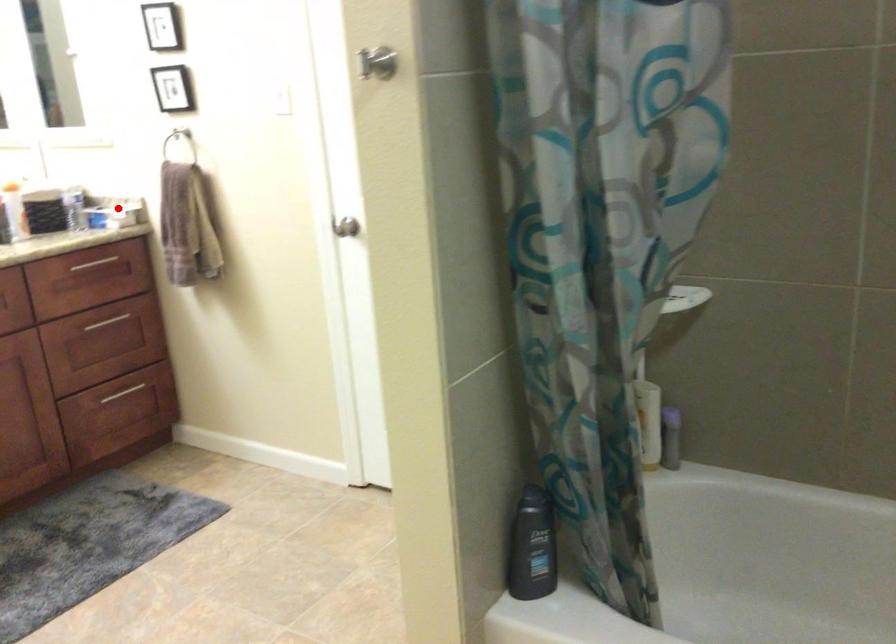
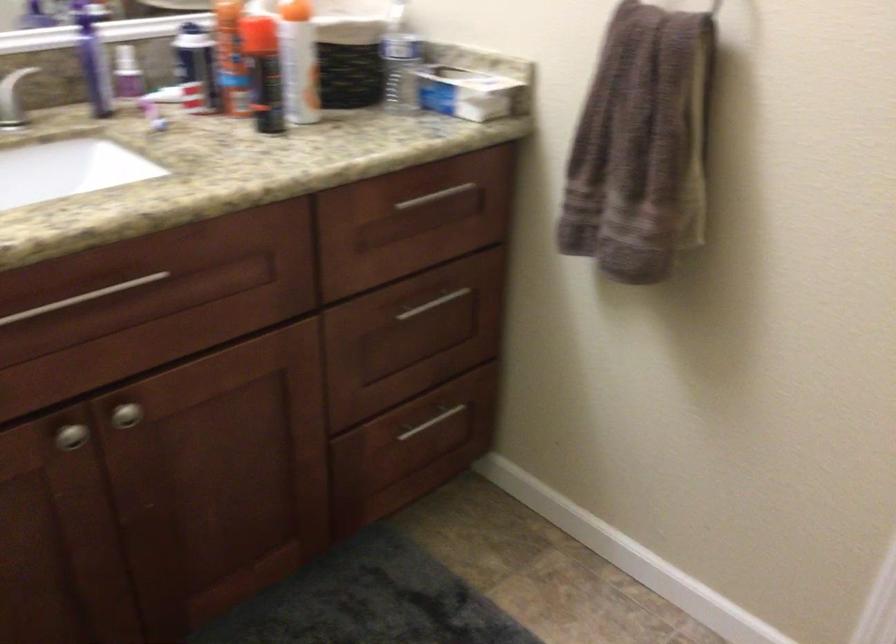
Locate, in the second image, the point that corresponds to the highlighted location in the first image.

(470, 91)